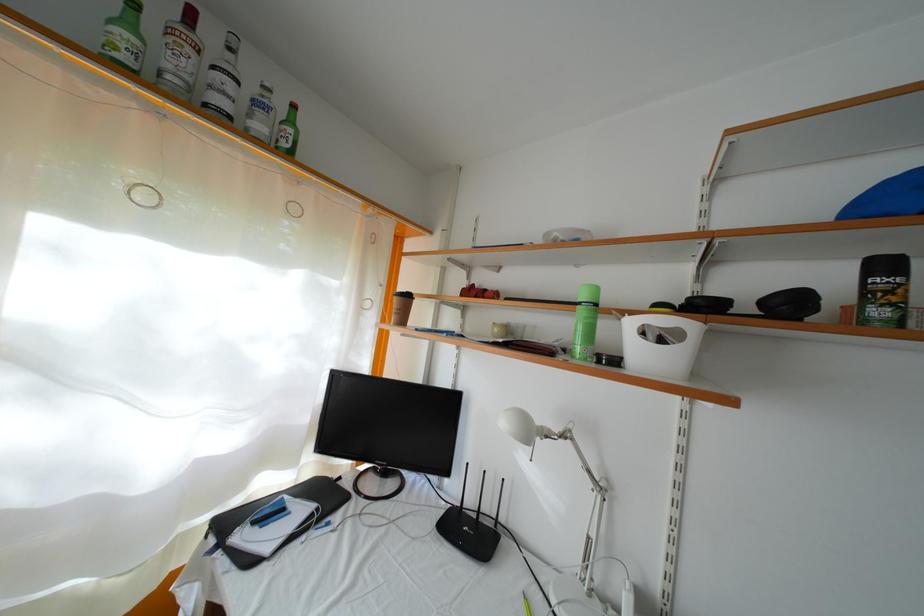
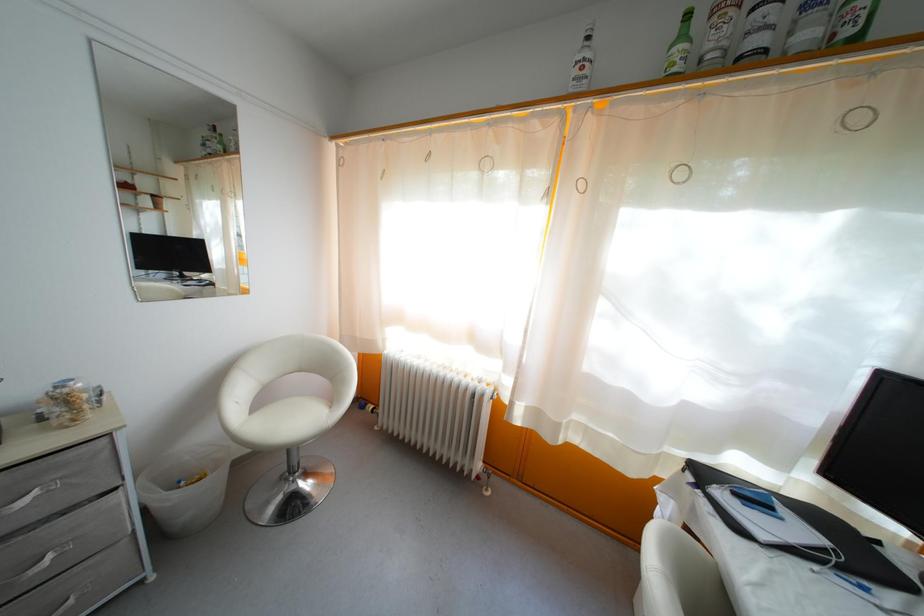
Locate, in the second image, the point that corresponds to the point at 290,151 in the first image.

(854, 39)